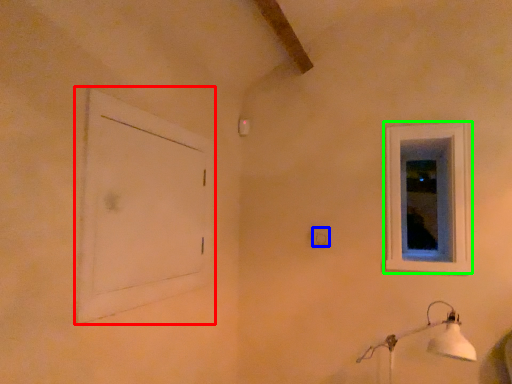
Question: Which object is positioned closest to window frame (highlighted by a red box)? Select from electric outlet (highlighted by a blue box) and window (highlighted by a green box).

Choices:
 (A) electric outlet
 (B) window

Answer: (A)